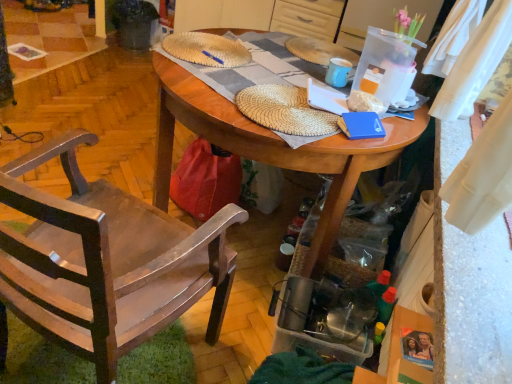
The image size is (512, 384). I want to click on vacant region to the right of blue matte book at center, so click(x=391, y=124).